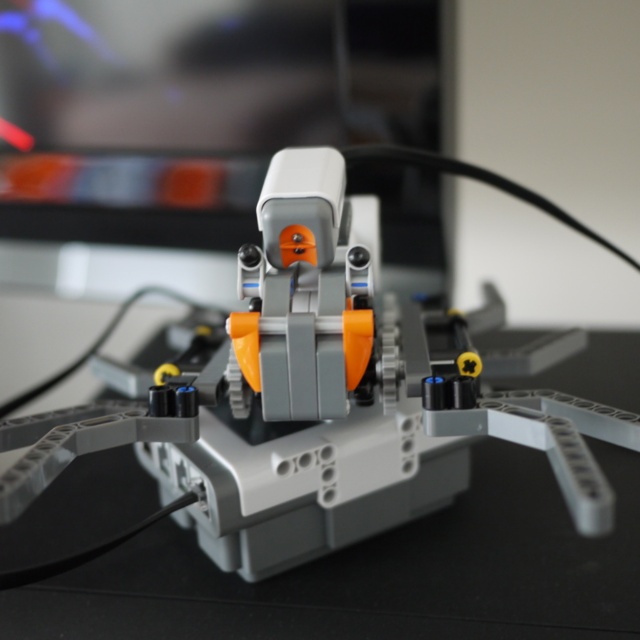
Question: Can you confirm if matte plastic robot at center is positioned above matte black monitor at upper center?

Choices:
 (A) no
 (B) yes

Answer: (A)

Question: Is matte plastic robot at center thinner than matte black monitor at upper center?

Choices:
 (A) no
 (B) yes

Answer: (A)

Question: From the image, what is the correct spatial relationship of matte plastic robot at center in relation to matte black monitor at upper center?

Choices:
 (A) above
 (B) below

Answer: (B)

Question: Which point appears farthest from the camera in this image?

Choices:
 (A) (67, 44)
 (B) (80, 451)

Answer: (A)